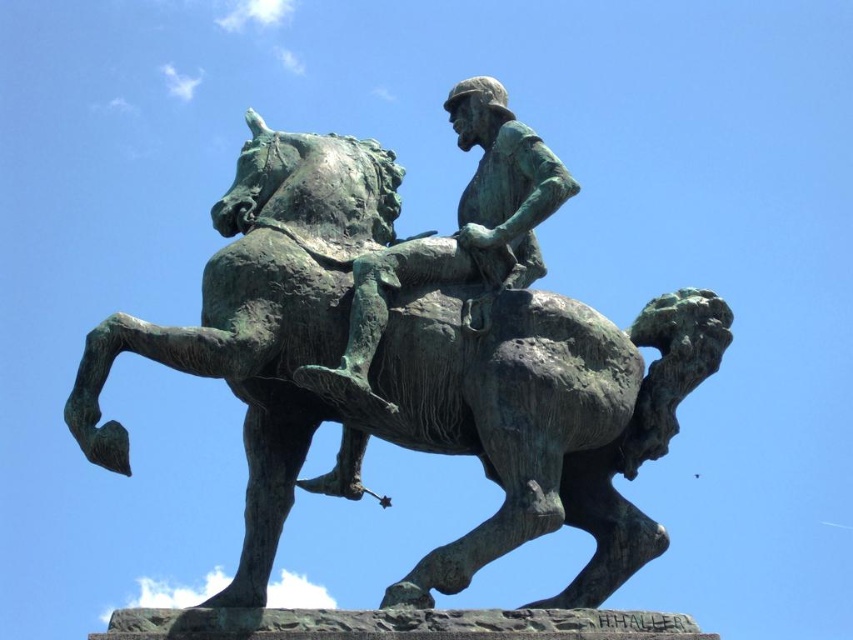
You are an art student analyzing the statue in the image. You notice two objects labeled green patina horse and rider at center and green patina figure at center. Which one has a greater height?

The green patina horse and rider at center is much taller than the green patina figure at center.

You are standing in front of the bronze statue and want to touch both the green patina horse and rider at center and the green patina figure at center. Which one will your hand reach first?

The green patina horse and rider at center will be reached first because it is closer to you than the green patina figure at center.